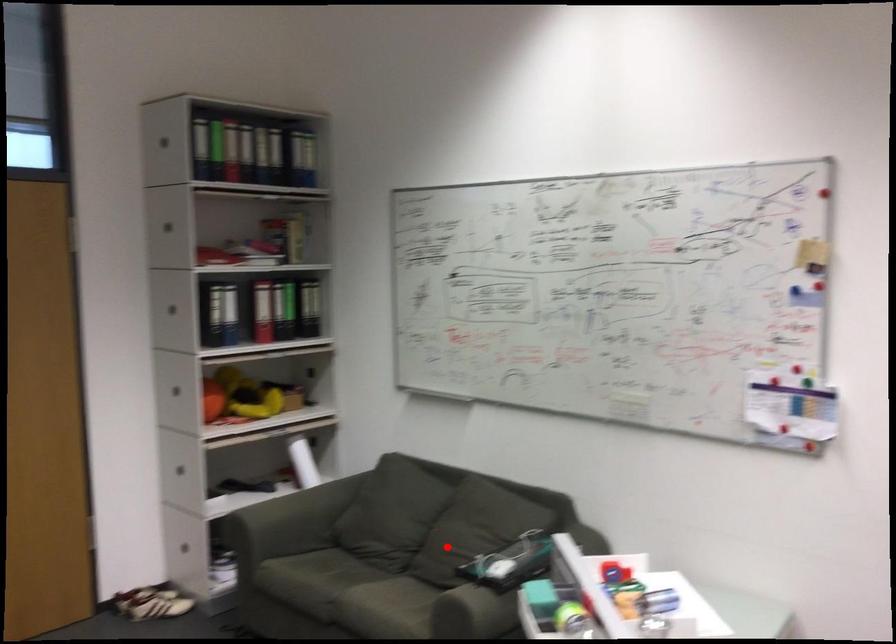
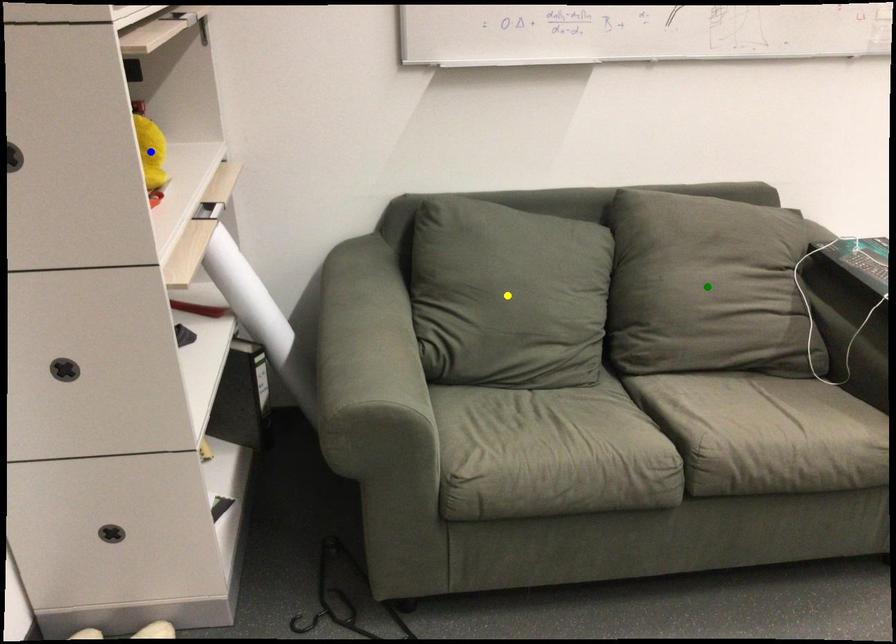
Question: I am providing you with two images of the same scene from different viewpoints. A red point is marked on the first image. You are given multiple points on the second image. Which spot in image 2 lines up with the point in image 1?

Choices:
 (A) yellow point
 (B) green point
 (C) blue point

Answer: (B)